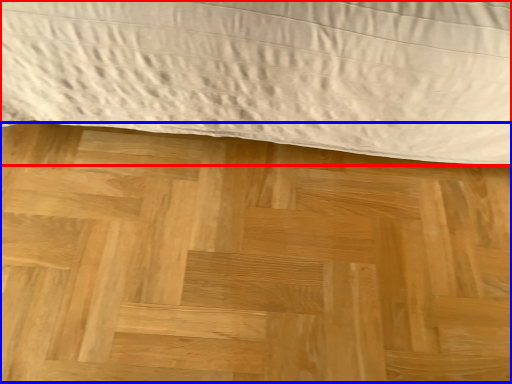
Question: Among these objects, which one is nearest to the camera, bed (highlighted by a red box) or plywood (highlighted by a blue box)?

Choices:
 (A) bed
 (B) plywood

Answer: (A)